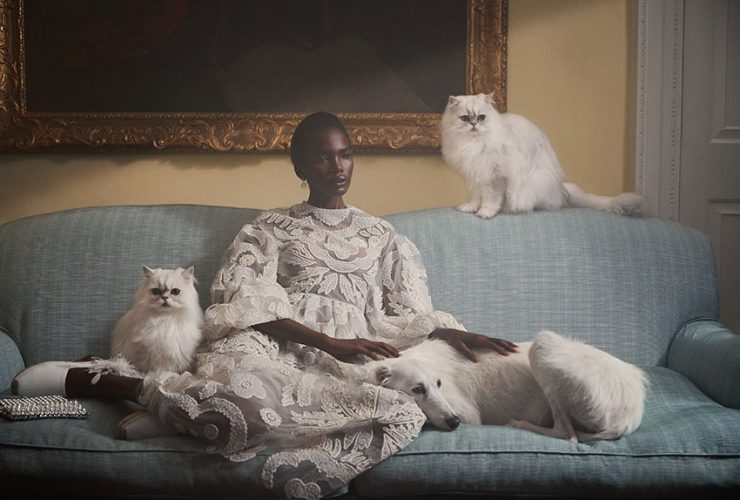
The height and width of the screenshot is (500, 740). Identify the location of pale blue sofa. (56, 255).